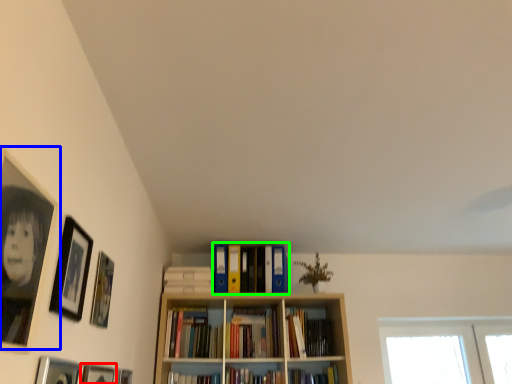
Question: Which object is the closest to the picture frame (highlighted by a red box)? Choose among these: picture frame (highlighted by a blue box) or book (highlighted by a green box).

Choices:
 (A) picture frame
 (B) book

Answer: (A)